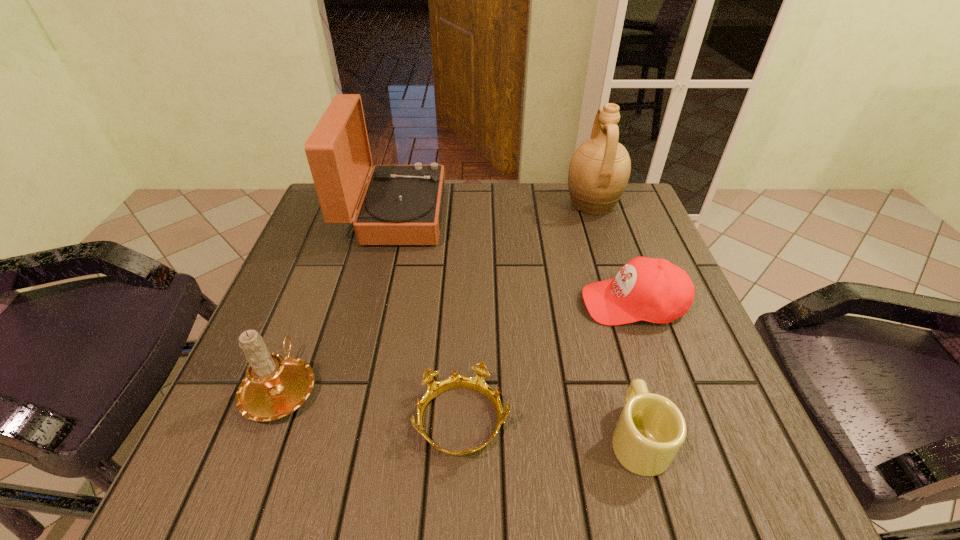
Find the location of a particular element. Image resolution: width=960 pixels, height=540 pixels. phonograph record that is at the left edge is located at coordinates (402, 204).

Identify the location of candle that is at the left edge. (x=274, y=386).

The image size is (960, 540). I want to click on pitcher at the right edge, so coord(599,170).

Find the location of `baseball cap present at the right edge`. baseball cap present at the right edge is located at coordinates (654, 290).

Identify the location of mug at the right edge. (651, 429).

I want to click on object at the far left corner, so click(402, 204).

The height and width of the screenshot is (540, 960). In order to click on object that is positioned at the far right corner in this screenshot , I will do `click(599, 170)`.

At what (x,y) coordinates should I click in order to perform the action: click on object at the near right corner. Please return your answer as a coordinate pair (x, y). The image size is (960, 540). Looking at the image, I should click on (651, 429).

Locate an element on the screen. The image size is (960, 540). free location at the far edge of the desktop is located at coordinates click(565, 184).

In the image, there is a desktop. Where is `vacant space at the left edge`? The width and height of the screenshot is (960, 540). vacant space at the left edge is located at coordinates (308, 303).